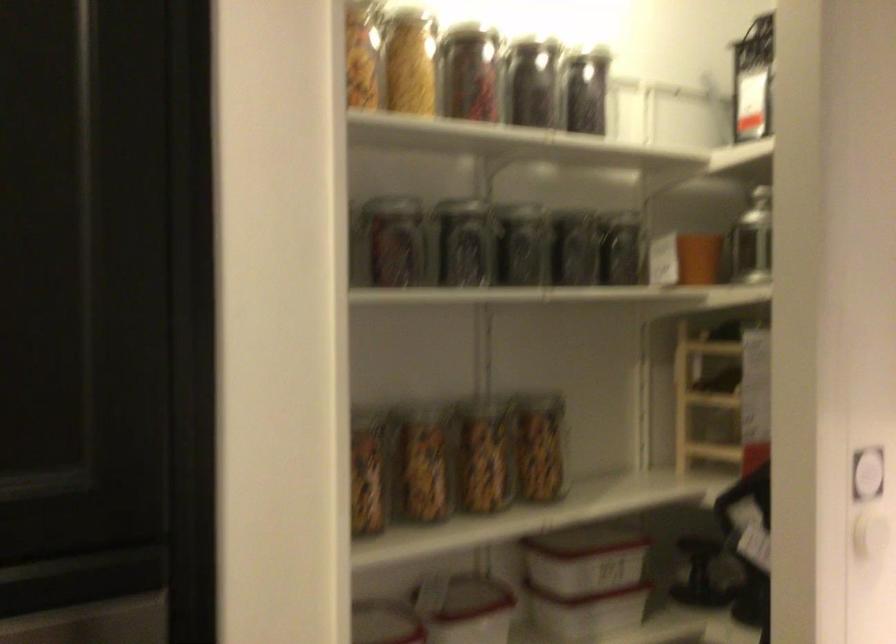
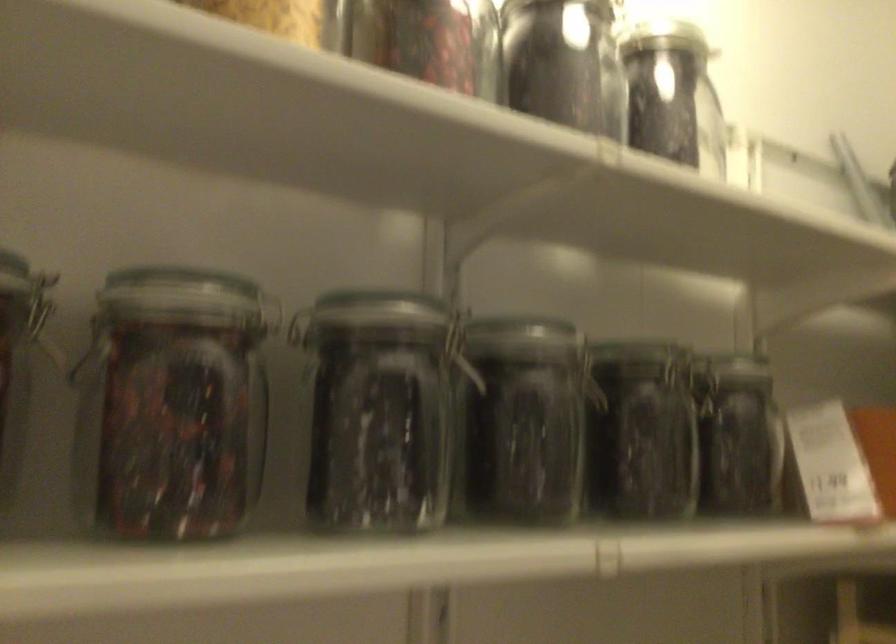
In the second image, find the point that corresponds to the point at 538,87 in the first image.

(564, 64)